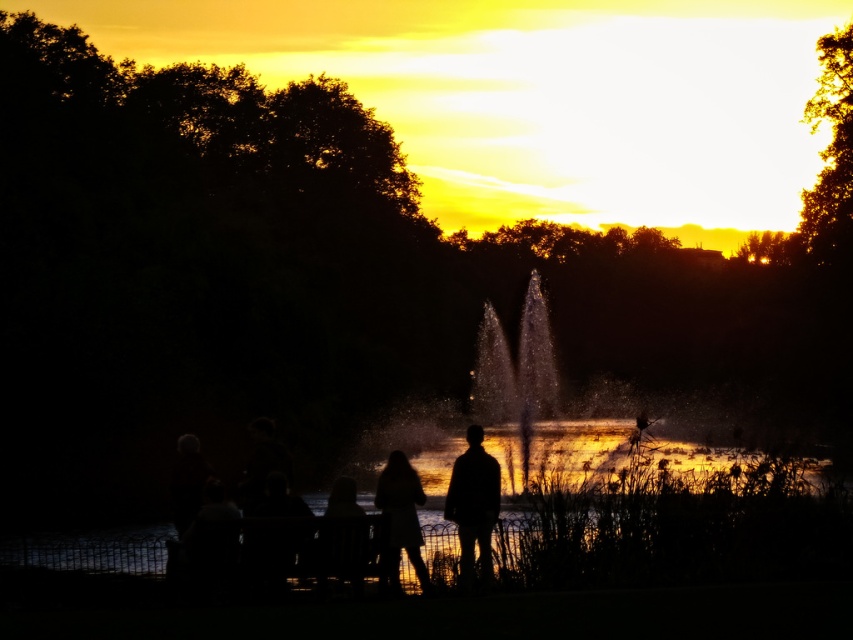
In the scene shown: You are planning to take a photo of the sunset with the silhouette figure at center and the silhouette fabric person at lower center in the frame. Which of the two objects should be closer to the camera to ensure both are fully visible in the photo?

The silhouette figure at center is much taller than the silhouette fabric person at lower center, so to ensure both are fully visible in the photo, the silhouette fabric person at lower center should be closer to the camera.

You are standing at the center of the image and want to locate the silhouette hair at center. According to the coordinates provided, in which direction should you look to find it?

The silhouette hair at center is located at coordinates point [399,518]. Since the center of the image is typically at point [426,320], you should look to the upper right direction to find it.